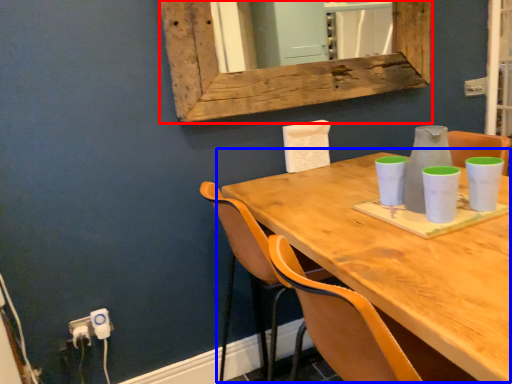
Question: Among these objects, which one is farthest to the camera, window frame (highlighted by a red box) or table (highlighted by a blue box)?

Choices:
 (A) window frame
 (B) table

Answer: (A)